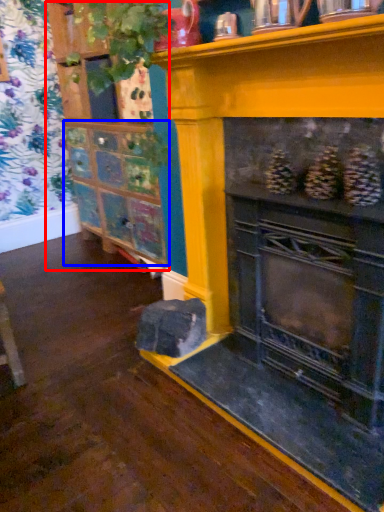
Question: Which point is closer to the camera, shelf (highlighted by a red box) or shelf (highlighted by a blue box)?

Choices:
 (A) shelf
 (B) shelf

Answer: (A)